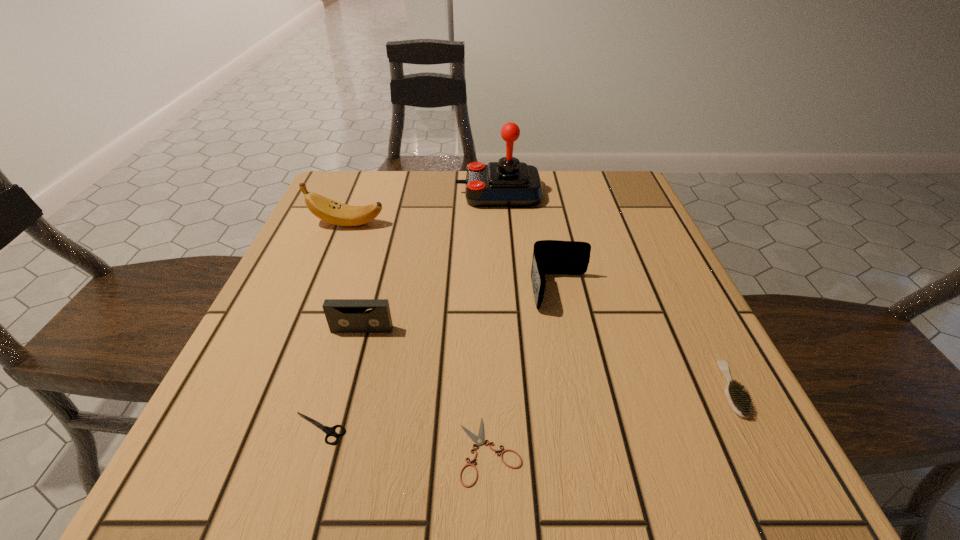
The image size is (960, 540). Identify the location of vacant point that satisfies the following two spatial constraints: 1. on the front-facing side of the rightmost object; 2. on the right side of the fourth farthest object. (346, 389).

You are a GUI agent. You are given a task and a screenshot of the screen. Output one action in this format:
    pyautogui.click(x=<x>, y=<y>)
    Task: Click on the vacant space that satisfies the following two spatial constraints: 1. on the base of the tallest object; 2. on the front-facing side of the fourth shortest object
    This screenshot has height=540, width=960.
    Given the screenshot: What is the action you would take?
    pyautogui.click(x=507, y=329)